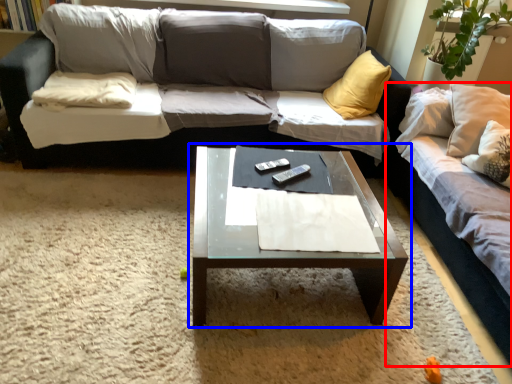
Question: Which of the following is the farthest to the observer, studio couch (highlighted by a red box) or coffee table (highlighted by a blue box)?

Choices:
 (A) studio couch
 (B) coffee table

Answer: (B)